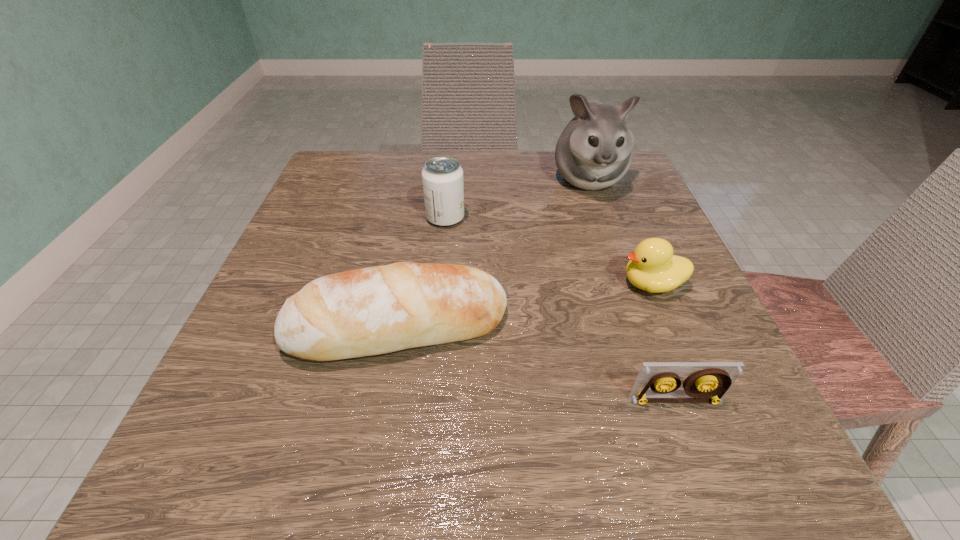
Find the location of a particular element. vacant area at the near edge is located at coordinates (318, 460).

The image size is (960, 540). I want to click on free space at the left edge of the desktop, so click(304, 220).

Find the location of a particular element. The height and width of the screenshot is (540, 960). vacant space at the right edge is located at coordinates (631, 242).

You are a GUI agent. You are given a task and a screenshot of the screen. Output one action in this format:
    pyautogui.click(x=<x>, y=<y>)
    Task: Click on the vacant space at the far left corner of the desktop
    
    Given the screenshot: What is the action you would take?
    pyautogui.click(x=390, y=160)

I want to click on free space at the far right corner, so coord(633,166).

Image resolution: width=960 pixels, height=540 pixels. I want to click on vacant space at the near right corner of the desktop, so click(799, 494).

At what (x,y) coordinates should I click in order to perform the action: click on free space between the fourth nearest object and the videotape. Please return your answer as a coordinate pair (x, y). Looking at the image, I should click on (561, 309).

Image resolution: width=960 pixels, height=540 pixels. What are the coordinates of `empty location between the bread and the duckling` in the screenshot? It's located at (525, 306).

This screenshot has height=540, width=960. I want to click on unoccupied area between the soda can and the duckling, so 549,251.

Identify the location of vacant point located between the fourth nearest object and the shortest object. (561, 309).